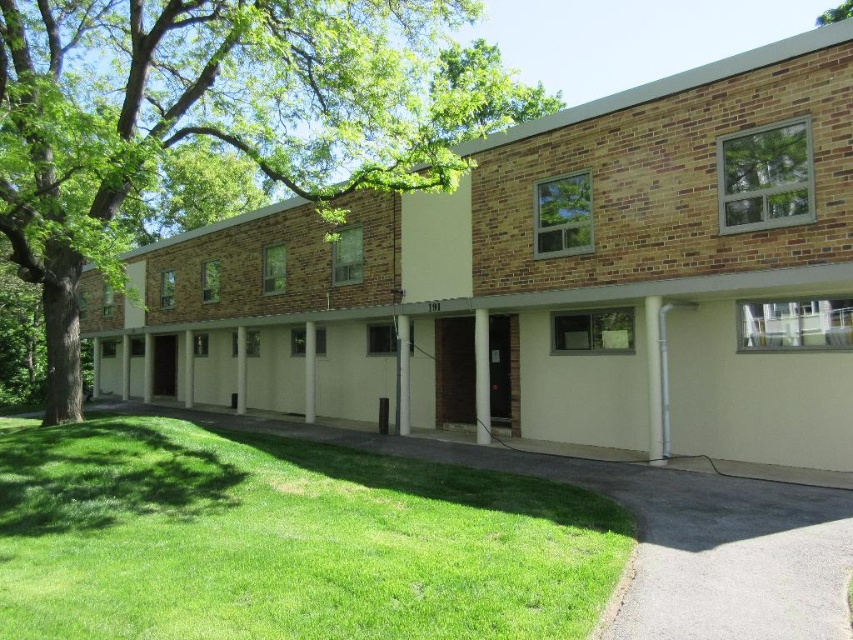
What do you see at coordinates (285, 540) in the screenshot? I see `green grass at lower left` at bounding box center [285, 540].

Between green grass at lower left and green leafy tree at upper right, which one has more height?

green leafy tree at upper right

Does point (7, 612) lie behind point (843, 4)?

No.

This screenshot has height=640, width=853. In order to click on green grass at lower left in this screenshot , I will do `click(285, 540)`.

Who is more distant from viewer, (383, 458) or (450, 49)?

The point (450, 49) is behind.

Which is more to the left, green grass at lower left or green leafy tree at upper left?

green leafy tree at upper left is more to the left.

Is point (99, 556) farther from camera compared to point (70, 12)?

No, it is in front of (70, 12).

Identify the location of green grass at lower left. (285, 540).

Based on the photo, does green leafy tree at upper left appear over green leafy tree at upper right?

No, green leafy tree at upper left is not above green leafy tree at upper right.

Describe the element at coordinates (221, 116) in the screenshot. I see `green leafy tree at upper left` at that location.

Which is in front, point (309, 140) or point (831, 19)?

Point (309, 140) is in front.

This screenshot has width=853, height=640. I want to click on green leafy tree at upper left, so click(x=221, y=116).